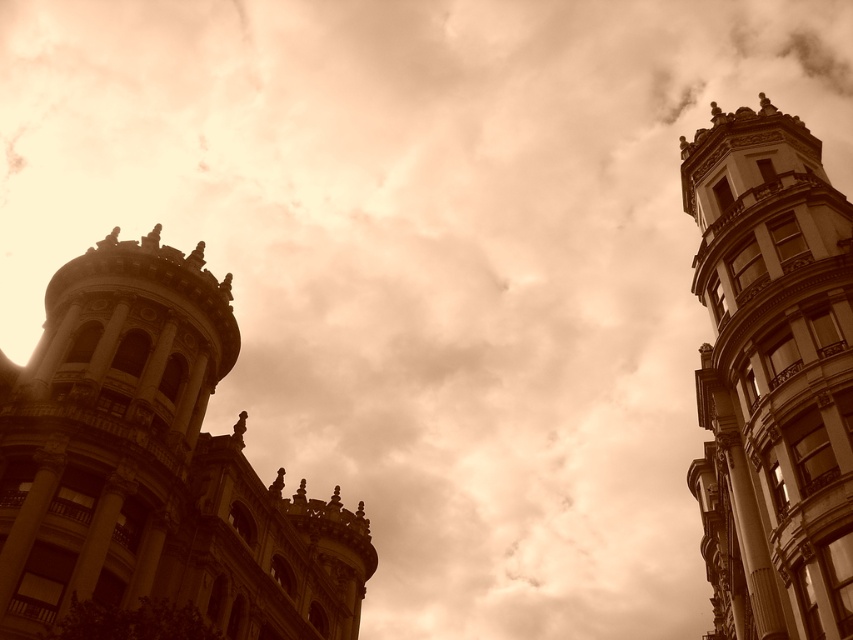
You are a drone operator trying to capture a photo of the sepia stone tower at left. The drone must fly from the center of the image to the tower. What is the direction the drone should fly to reach the tower?

The sepia stone tower at left is located at point coordinates, so the drone should fly to the left and slightly downward from the center to reach it.

You are an architect analyzing the two towers in the image. Based on the scene, which of the two towers, the sepia stone tower at left or the smooth stone tower at right, has a greater height?

The smooth stone tower at right is taller than the sepia stone tower at left.